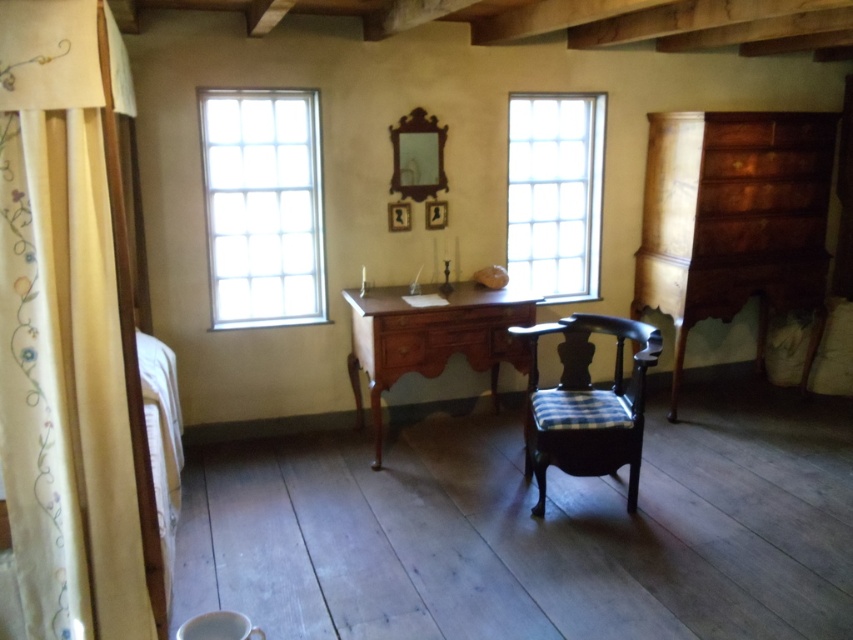
In the scene shown: Who is more forward, [585,385] or [460,328]?

Point [585,385] is more forward.

Does point (589, 394) lie behind point (445, 296)?

That is False.

The width and height of the screenshot is (853, 640). Identify the location of dark wood chair with blue plaid cushion at center. (585, 404).

Does shiny brown wood dresser at right lie in front of clear glass window at upper right?

Yes, it is in front of clear glass window at upper right.

Is shiny brown wood dresser at right above clear glass window at upper right?

No, shiny brown wood dresser at right is not above clear glass window at upper right.

Does point (747, 195) come behind point (541, 97)?

That is False.

I want to click on shiny brown wood dresser at right, so click(734, 220).

Who is shorter, clear glass window at upper right or wooden desk at center?

wooden desk at center is shorter.

Between point (537, 177) and point (375, 374), which one is positioned in front?

Point (375, 374) is more forward.

Between point (519, 128) and point (439, 358), which one is positioned behind?

Positioned behind is point (519, 128).

I want to click on clear glass window at upper right, so click(x=555, y=193).